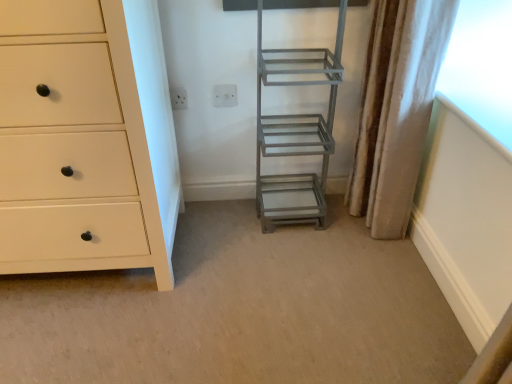
Find the location of a particular element. silky beige curtain at right is located at coordinates point(397,110).

The image size is (512, 384). In order to click on white plastic electric outlet at upper center, the 2th electric outlet when ordered from left to right in this screenshot , I will do `click(225, 95)`.

The height and width of the screenshot is (384, 512). I want to click on silky beige curtain at right, so click(397, 110).

Is white plastic electric outlet at upper center, the 1th electric outlet positioned from the right, taller than white matte chest of drawers at left?

No, white plastic electric outlet at upper center, the 1th electric outlet positioned from the right, is not taller than white matte chest of drawers at left.

Is white matte chest of drawers at left inside white plastic electric outlet at upper center, the 2th electric outlet when ordered from left to right?

No, white matte chest of drawers at left is not inside white plastic electric outlet at upper center, the 2th electric outlet when ordered from left to right.

Considering the positions of points (223, 84) and (95, 224), is point (223, 84) farther from camera compared to point (95, 224)?

Yes, it is.

Is white plastic electric outlet at upper center, the 1th electric outlet positioned from the right, in front of or behind white matte chest of drawers at left in the image?

white plastic electric outlet at upper center, the 1th electric outlet positioned from the right, is positioned farther from the viewer than white matte chest of drawers at left.

Is metallic gray ladder at center placed right next to silky beige curtain at right?

They are not placed beside each other.

Is metallic gray ladder at center inside the boundaries of silky beige curtain at right, or outside?

metallic gray ladder at center is not enclosed by silky beige curtain at right.

From a real-world perspective, is metallic gray ladder at center on top of silky beige curtain at right?

No, from a real-world perspective, metallic gray ladder at center is not on top of silky beige curtain at right.

Where is `curtain on the right of metallic gray ladder at center`? curtain on the right of metallic gray ladder at center is located at coordinates (397, 110).

In order to click on ladder in front of the white plastic electric outlet at upper center, the 1th electric outlet positioned from the left in this screenshot , I will do `click(295, 132)`.

Is white plastic electric outlet at upper center, the 1th electric outlet positioned from the left, inside or outside of metallic gray ladder at center?

white plastic electric outlet at upper center, the 1th electric outlet positioned from the left, exists outside the volume of metallic gray ladder at center.

Consider the image. Considering the positions of objects white plastic electric outlet at upper center, the 1th electric outlet positioned from the left, and metallic gray ladder at center in the image provided, who is more to the left, white plastic electric outlet at upper center, the 1th electric outlet positioned from the left, or metallic gray ladder at center?

white plastic electric outlet at upper center, the 1th electric outlet positioned from the left, is more to the left.

Is white plastic electric outlet at upper center, the 1th electric outlet positioned from the left, with metallic gray ladder at center?

No, white plastic electric outlet at upper center, the 1th electric outlet positioned from the left, is not in contact with metallic gray ladder at center.

Considering the relative positions of silky beige curtain at right and metallic gray ladder at center in the image provided, is silky beige curtain at right to the left or to the right of metallic gray ladder at center?

In the image, silky beige curtain at right appears on the right side of metallic gray ladder at center.

Can you tell me how much silky beige curtain at right and metallic gray ladder at center differ in facing direction?

85.6 degrees separate the facing orientations of silky beige curtain at right and metallic gray ladder at center.

Is silky beige curtain at right located outside metallic gray ladder at center?

silky beige curtain at right lies outside metallic gray ladder at center's area.

Is the surface of silky beige curtain at right in direct contact with metallic gray ladder at center?

No, silky beige curtain at right is not in contact with metallic gray ladder at center.

Is white matte chest of drawers at left not near silky beige curtain at right?

No.

Is white matte chest of drawers at left at the right side of silky beige curtain at right?

No, white matte chest of drawers at left is not to the right of silky beige curtain at right.

Can silky beige curtain at right be found inside white matte chest of drawers at left?

No, silky beige curtain at right is not surrounded by white matte chest of drawers at left.

Considering the sizes of objects white matte chest of drawers at left and silky beige curtain at right in the image provided, who is shorter, white matte chest of drawers at left or silky beige curtain at right?

With less height is silky beige curtain at right.

Which of these two, white plastic electric outlet at upper center, the 2th electric outlet when ordered from left to right, or white plastic electric outlet at upper center, the 1th electric outlet positioned from the left, is wider?

With larger width is white plastic electric outlet at upper center, the 1th electric outlet positioned from the left.

Which is nearer, (213, 90) or (178, 97)?

The point (178, 97) is closer to the camera.

From the image's perspective, relative to white plastic electric outlet at upper center, the 1th electric outlet positioned from the left, is white plastic electric outlet at upper center, the 2th electric outlet when ordered from left to right, above or below?

Clearly, from the image's perspective, white plastic electric outlet at upper center, the 2th electric outlet when ordered from left to right, is above white plastic electric outlet at upper center, the 1th electric outlet positioned from the left.

Image resolution: width=512 pixels, height=384 pixels. I want to click on electric outlet below the white plastic electric outlet at upper center, the 2th electric outlet when ordered from left to right (from a real-world perspective), so click(x=178, y=98).

In the image, is white matte chest of drawers at left on the left side or the right side of metallic gray ladder at center?

white matte chest of drawers at left is positioned on metallic gray ladder at center's left side.

Which point is more forward, (17,98) or (264,176)?

The point (17,98) is closer.

Based on their sizes in the image, would you say white matte chest of drawers at left is bigger or smaller than metallic gray ladder at center?

Clearly, white matte chest of drawers at left is larger in size than metallic gray ladder at center.

You are a GUI agent. You are given a task and a screenshot of the screen. Output one action in this format:
    pyautogui.click(x=<x>, y=<y>)
    Task: Click on the ladder that appears below the white matte chest of drawers at left (from a real-world perspective)
    This screenshot has height=384, width=512.
    Given the screenshot: What is the action you would take?
    pyautogui.click(x=295, y=132)

This screenshot has height=384, width=512. I want to click on the 2nd electric outlet behind the white matte chest of drawers at left, so click(225, 95).

Locate an element on the screen. This screenshot has width=512, height=384. curtain below the metallic gray ladder at center (from the image's perspective) is located at coordinates (397, 110).

From the image, which object appears to be farther from white plastic electric outlet at upper center, the 2th electric outlet when ordered from left to right, metallic gray ladder at center or white matte chest of drawers at left?

white matte chest of drawers at left is positioned further to the anchor white plastic electric outlet at upper center, the 2th electric outlet when ordered from left to right.

Estimate the real-world distances between objects in this image. Which object is further from white plastic electric outlet at upper center, acting as the second electric outlet starting from the right, metallic gray ladder at center or white plastic electric outlet at upper center, the 1th electric outlet positioned from the right?

metallic gray ladder at center is further to white plastic electric outlet at upper center, acting as the second electric outlet starting from the right.

Looking at the image, which one is located closer to white plastic electric outlet at upper center, the 1th electric outlet positioned from the left, silky beige curtain at right or white matte chest of drawers at left?

Based on the image, white matte chest of drawers at left appears to be nearer to white plastic electric outlet at upper center, the 1th electric outlet positioned from the left.

Based on the photo, from the image, which object appears to be nearer to silky beige curtain at right, metallic gray ladder at center or white plastic electric outlet at upper center, the 1th electric outlet positioned from the right?

The object closer to silky beige curtain at right is metallic gray ladder at center.

Based on their spatial positions, is white plastic electric outlet at upper center, acting as the second electric outlet starting from the right, or silky beige curtain at right closer to white matte chest of drawers at left?

white plastic electric outlet at upper center, acting as the second electric outlet starting from the right, is closer to white matte chest of drawers at left.

Which object lies nearer to the anchor point metallic gray ladder at center, silky beige curtain at right or white plastic electric outlet at upper center, the 2th electric outlet when ordered from left to right?

silky beige curtain at right is closer to metallic gray ladder at center.

Which object lies nearer to the anchor point metallic gray ladder at center, silky beige curtain at right or white plastic electric outlet at upper center, the 1th electric outlet positioned from the left?

Based on the image, silky beige curtain at right appears to be nearer to metallic gray ladder at center.

From the image, which object appears to be farther from silky beige curtain at right, white matte chest of drawers at left or white plastic electric outlet at upper center, acting as the second electric outlet starting from the right?

white matte chest of drawers at left is further to silky beige curtain at right.

Find the location of a particular element. This screenshot has width=512, height=384. electric outlet situated between white plastic electric outlet at upper center, acting as the second electric outlet starting from the right, and silky beige curtain at right from left to right is located at coordinates (225, 95).

You are a GUI agent. You are given a task and a screenshot of the screen. Output one action in this format:
    pyautogui.click(x=<x>, y=<y>)
    Task: Click on the electric outlet located between metallic gray ladder at center and white plastic electric outlet at upper center, the 2th electric outlet when ordered from left to right, in the depth direction
    This screenshot has width=512, height=384.
    Given the screenshot: What is the action you would take?
    pyautogui.click(x=178, y=98)

Image resolution: width=512 pixels, height=384 pixels. Identify the location of ladder between white matte chest of drawers at left and silky beige curtain at right in the horizontal direction. (295, 132).

This screenshot has width=512, height=384. What are the coordinates of `electric outlet located between white matte chest of drawers at left and white plastic electric outlet at upper center, the 2th electric outlet when ordered from left to right, in the depth direction` in the screenshot? It's located at click(x=178, y=98).